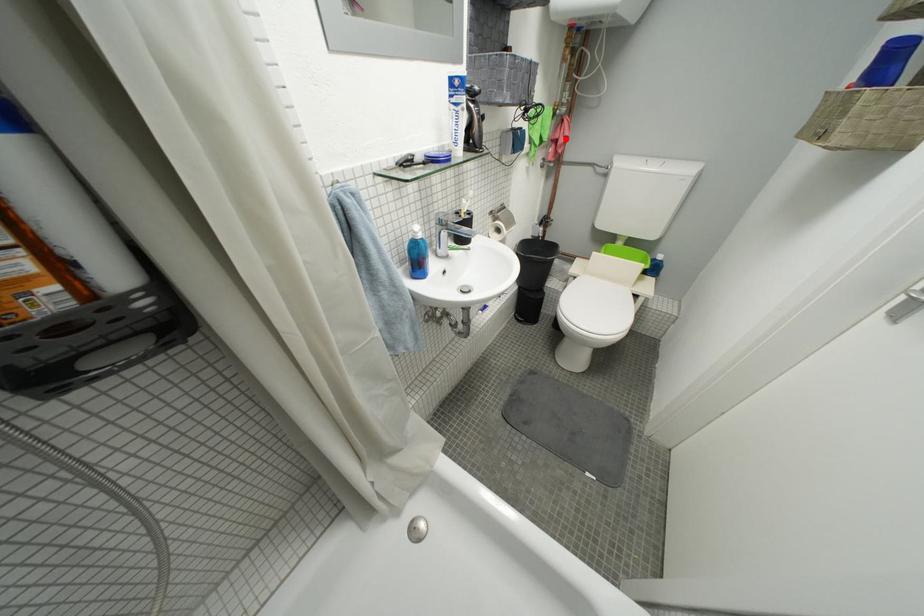
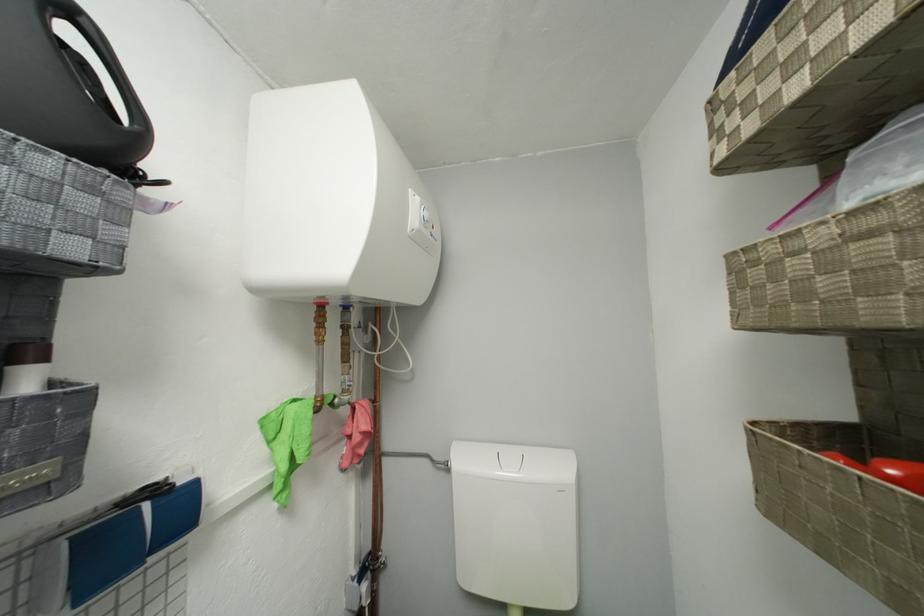
Question: I am providing you with two images of the same scene from different viewpoints. In image1, a red point is highlighted. Considering the same 3D point in image2, which of the following is correct?

Choices:
 (A) It is closer
 (B) It is farther

Answer: (B)